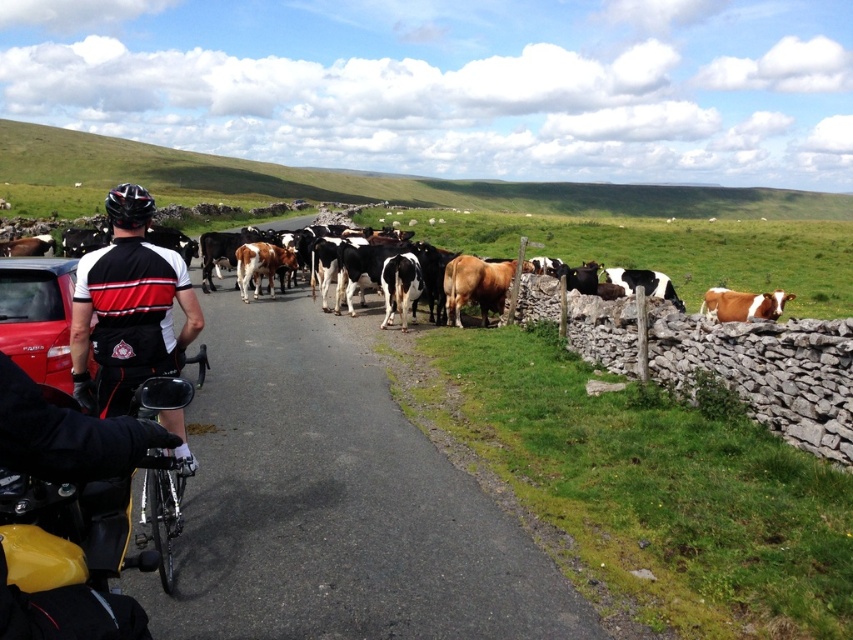
You are a cyclist trying to pass through the road blocked by cows. You see a black and white cycling jersey at center and a matte black car at left. Is there enough space between them to safely move your bicycle through?

The distance between the black and white cycling jersey at center and the matte black car at left is 1.47 meters. Since a typical bicycle requires about 0.7 meters of space to pass, there is sufficient space to safely maneuver through the gap.

You are a cyclist approaching the scene and see the black and white cycling jersey at center and the matte black car at left. Which object is closer to you?

The black and white cycling jersey at center is closer to you because it has a smaller size compared to the matte black car at left.

You are a cyclist approaching the scene and need to pass through. The black and white cycling jersey at center and the matte black car at left are in your path. Which one should you avoid first?

You should avoid the black and white cycling jersey at center first because it is closer to you than the matte black car at left.